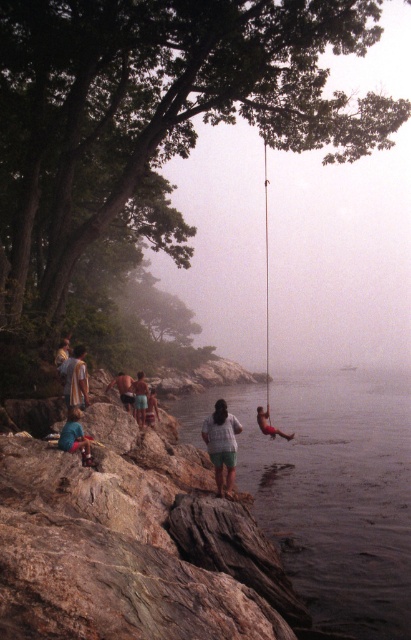
Does blue cotton shorts at lower left appear on the right side of tan skin man at center?

Indeed, blue cotton shorts at lower left is positioned on the right side of tan skin man at center.

Who is positioned more to the right, blue cotton shorts at lower left or tan skin man at center?

blue cotton shorts at lower left

Between point (83, 451) and point (112, 384), which one is positioned behind?

Point (112, 384)

This screenshot has height=640, width=411. Find the location of `blue cotton shorts at lower left`. blue cotton shorts at lower left is located at coordinates (74, 436).

Is point (62, 371) positioned behind point (263, 406)?

No, it is not.

Image resolution: width=411 pixels, height=640 pixels. Describe the element at coordinates (76, 378) in the screenshot. I see `white cotton shirt at left` at that location.

Between point (83, 355) and point (270, 424), which one is positioned in front?

Point (83, 355) is in front.

The height and width of the screenshot is (640, 411). In order to click on white cotton shirt at left in this screenshot , I will do `click(76, 378)`.

What do you see at coordinates (76, 378) in the screenshot? Image resolution: width=411 pixels, height=640 pixels. I see `white cotton shirt at left` at bounding box center [76, 378].

Does white cotton shirt at left have a lesser width compared to brown textured shorts at center?

Yes.

You are a GUI agent. You are given a task and a screenshot of the screen. Output one action in this format:
    pyautogui.click(x=<x>, y=<y>)
    Task: Click on the white cotton shirt at left
    The image size is (411, 640).
    Given the screenshot: What is the action you would take?
    pyautogui.click(x=76, y=378)